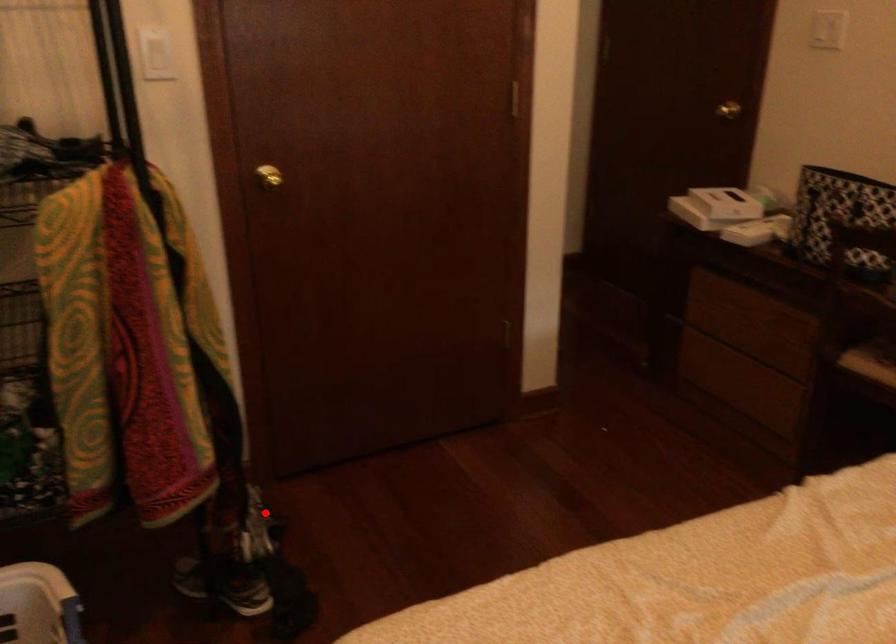
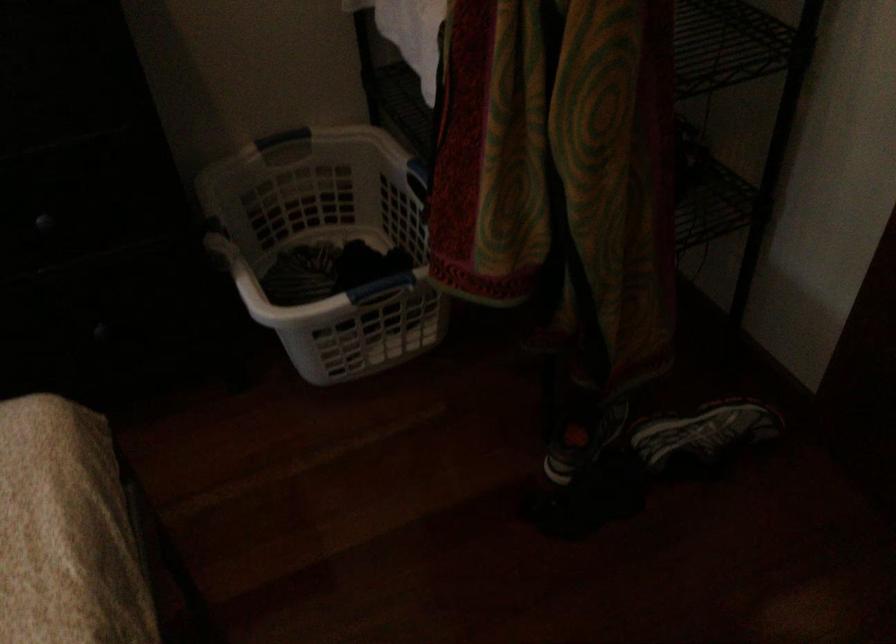
Locate, in the second image, the point that corresponds to the highlighted location in the first image.

(702, 436)